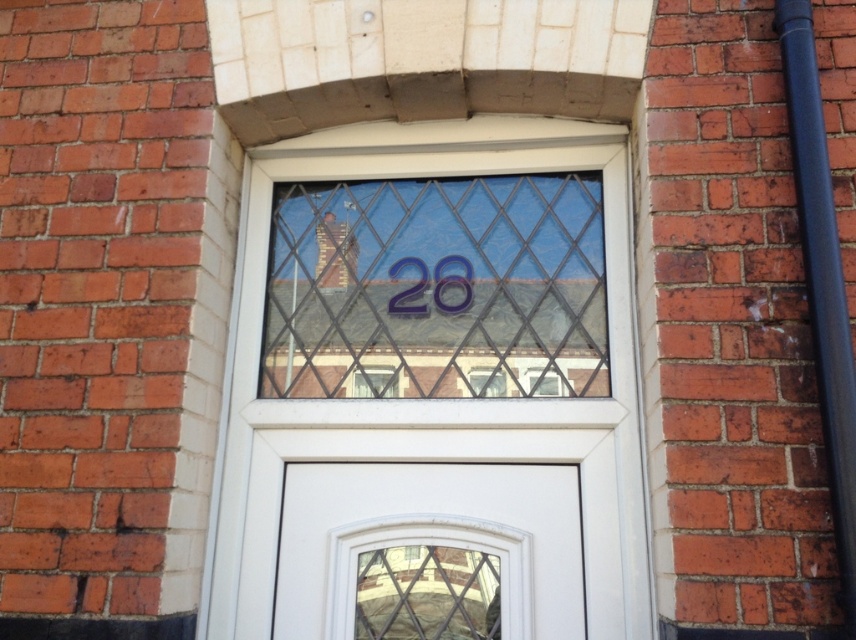
Is point (510, 328) more distant than point (424, 289)?

No, (510, 328) is closer to viewer.

Is transparent glass at center to the left of matte plastic number at center from the viewer's perspective?

No, transparent glass at center is not to the left of matte plastic number at center.

Does point (456, 372) lie behind point (467, 298)?

That is False.

You are a GUI agent. You are given a task and a screenshot of the screen. Output one action in this format:
    pyautogui.click(x=<x>, y=<y>)
    Task: Click on the transparent glass at center
    
    Given the screenshot: What is the action you would take?
    pyautogui.click(x=437, y=289)

Between point (348, 262) and point (298, 561), which one is positioned in front?

Point (298, 561)

How far apart are transparent glass at center and white glossy door at center?

The distance of transparent glass at center from white glossy door at center is 27.81 centimeters.

The image size is (856, 640). What do you see at coordinates (437, 289) in the screenshot?
I see `transparent glass at center` at bounding box center [437, 289].

Where is `transparent glass at center`? The image size is (856, 640). transparent glass at center is located at coordinates (437, 289).

Between white glossy door at center and matte plastic number at center, which one appears on the right side from the viewer's perspective?

matte plastic number at center is more to the right.

Does white glossy door at center have a greater width compared to matte plastic number at center?

Correct, the width of white glossy door at center exceeds that of matte plastic number at center.

Which is in front, point (547, 481) or point (408, 298)?

Point (547, 481)

Image resolution: width=856 pixels, height=640 pixels. Identify the location of white glossy door at center. click(429, 552).